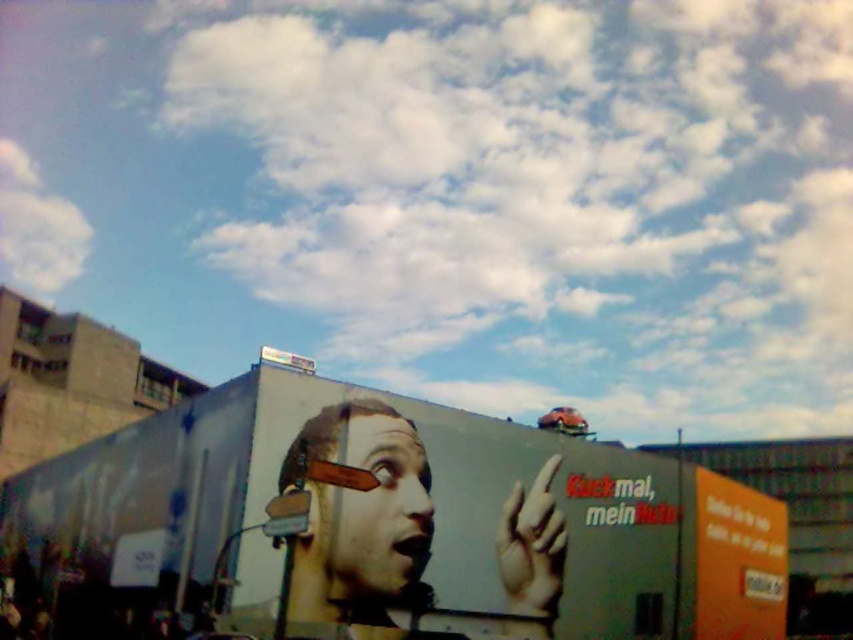
Question: Among these points, which one is nearest to the camera?

Choices:
 (A) (538, 596)
 (B) (502, 502)

Answer: (A)

Question: Is orange matte billboard at lower right to the right of smooth beige hand at lower center from the viewer's perspective?

Choices:
 (A) yes
 (B) no

Answer: (A)

Question: Does smooth skin face at center lie behind orange matte billboard at lower right?

Choices:
 (A) no
 (B) yes

Answer: (A)

Question: Which point appears closest to the camera in this image?

Choices:
 (A) (410, 474)
 (B) (733, 600)

Answer: (A)

Question: Which point appears closest to the camera in this image?

Choices:
 (A) (613, 525)
 (B) (740, 540)
 (C) (524, 531)
 (D) (328, 566)

Answer: (D)

Question: Does matte gray billboard at center appear on the left side of smooth skin face at center?

Choices:
 (A) yes
 (B) no

Answer: (B)